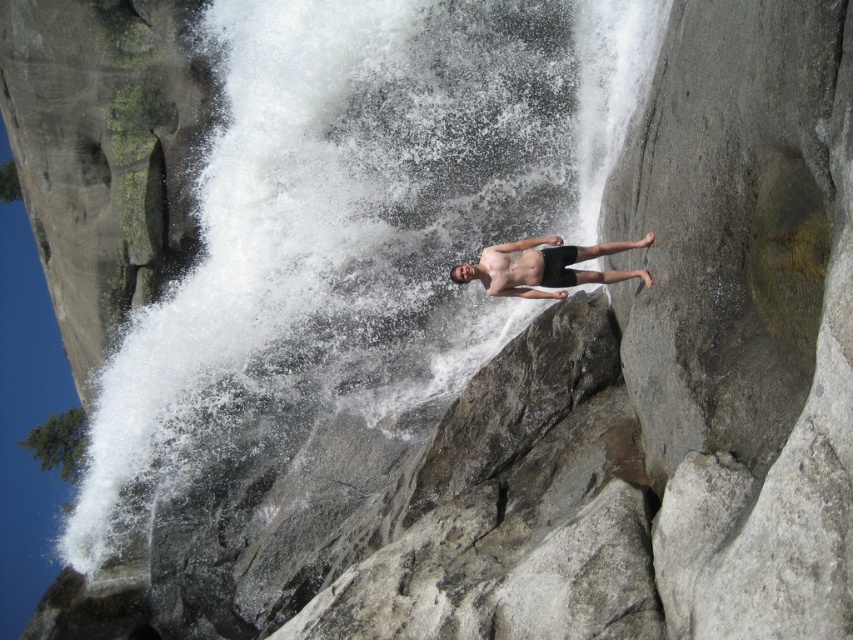
Is white frothy water at center positioned in front of smooth black shorts at center?

No, it is behind smooth black shorts at center.

Can you confirm if white frothy water at center is wider than smooth black shorts at center?

Yes.

Is point (596, 90) less distant than point (619, 241)?

No, it is behind (619, 241).

Where is `white frothy water at center`? white frothy water at center is located at coordinates (355, 237).